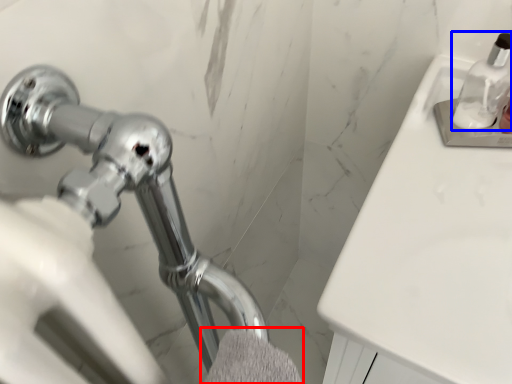
Question: Which object appears closest to the camera in this image, bath towel (highlighted by a red box) or soap dispenser (highlighted by a blue box)?

Choices:
 (A) bath towel
 (B) soap dispenser

Answer: (A)